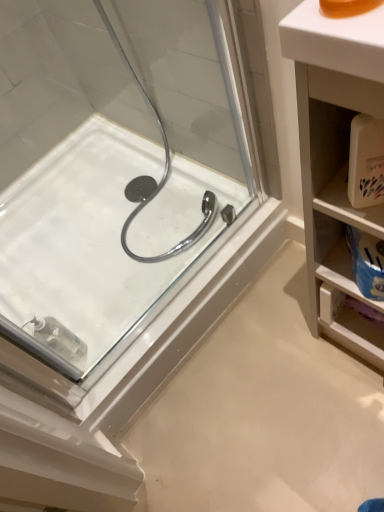
Question: Is white plastic cabinet at right inside white glossy bath at center?

Choices:
 (A) yes
 (B) no

Answer: (B)

Question: Does white glossy bath at center have a greater width compared to white plastic cabinet at right?

Choices:
 (A) no
 (B) yes

Answer: (B)

Question: Could you tell me if white glossy bath at center is facing white plastic cabinet at right?

Choices:
 (A) no
 (B) yes

Answer: (A)

Question: Is white glossy bath at center placed right next to white plastic cabinet at right?

Choices:
 (A) no
 (B) yes

Answer: (A)

Question: Can you confirm if white glossy bath at center is bigger than white plastic cabinet at right?

Choices:
 (A) yes
 (B) no

Answer: (A)

Question: Does white glossy bath at center appear on the left side of white plastic cabinet at right?

Choices:
 (A) no
 (B) yes

Answer: (B)

Question: From a real-world perspective, is white plastic cabinet at right beneath white glossy bath at center?

Choices:
 (A) yes
 (B) no

Answer: (B)

Question: Is white plastic cabinet at right wider than white glossy bath at center?

Choices:
 (A) no
 (B) yes

Answer: (A)

Question: Can you confirm if white plastic cabinet at right is positioned to the right of white glossy bath at center?

Choices:
 (A) no
 (B) yes

Answer: (B)

Question: Is white glossy bath at center at the back of white plastic cabinet at right?

Choices:
 (A) yes
 (B) no

Answer: (B)

Question: Does white plastic cabinet at right have a larger size compared to white glossy bath at center?

Choices:
 (A) yes
 (B) no

Answer: (B)

Question: Considering the relative sizes of white plastic cabinet at right and white glossy bath at center in the image provided, is white plastic cabinet at right taller than white glossy bath at center?

Choices:
 (A) no
 (B) yes

Answer: (B)

Question: Based on their sizes in the image, would you say white plastic cabinet at right is bigger or smaller than white glossy bath at center?

Choices:
 (A) small
 (B) big

Answer: (A)